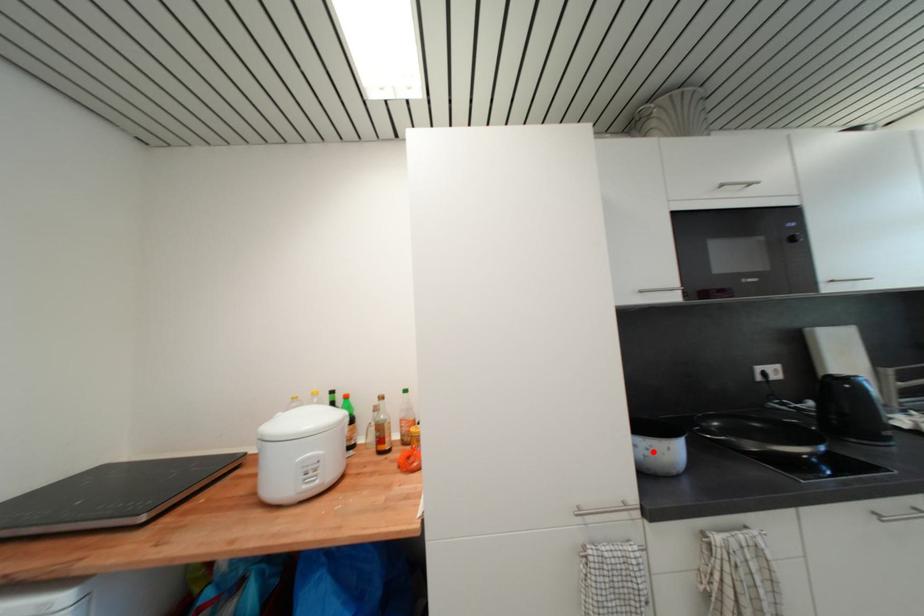
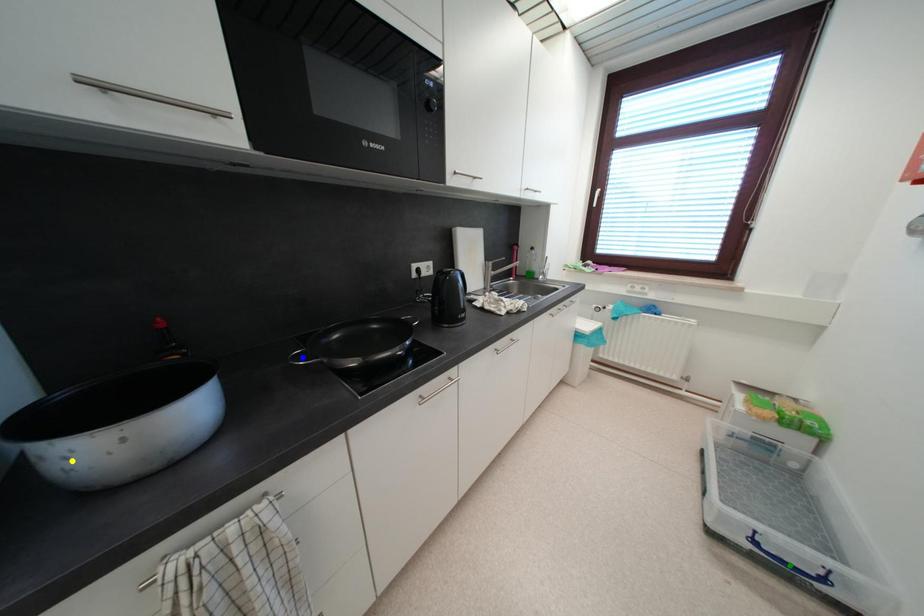
Question: I am providing you with two images of the same scene from different viewpoints. A red point is marked on the first image. You are given multiple points on the second image. Which point in image 2 is actually the same real-world point as the red point in image 1?

Choices:
 (A) blue point
 (B) yellow point
 (C) green point

Answer: (B)